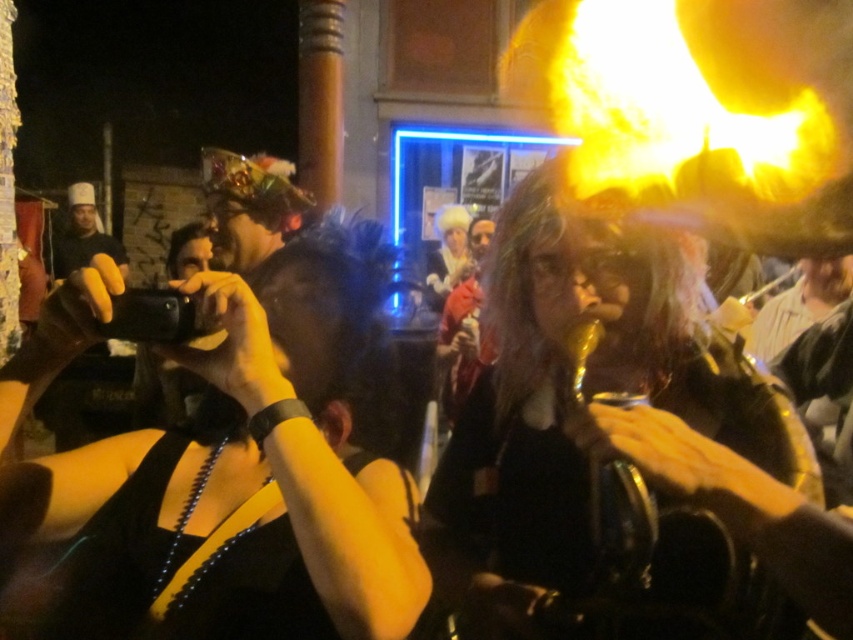
The height and width of the screenshot is (640, 853). What do you see at coordinates (242, 477) in the screenshot?
I see `black matte camera at center` at bounding box center [242, 477].

Which is behind, point (85, 490) or point (556, 598)?

Positioned behind is point (556, 598).

This screenshot has width=853, height=640. What do you see at coordinates (242, 477) in the screenshot?
I see `black matte camera at center` at bounding box center [242, 477].

Locate an element on the screen. The width and height of the screenshot is (853, 640). black matte camera at center is located at coordinates (242, 477).